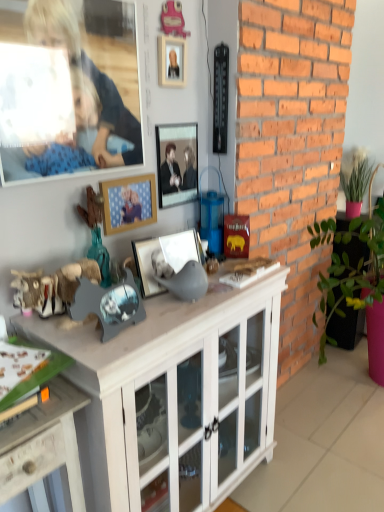
Where is `wooden photo frame at center, arranged as the 2th picture frame when ordered from the bottom`? This screenshot has height=512, width=384. wooden photo frame at center, arranged as the 2th picture frame when ordered from the bottom is located at coordinates (128, 203).

In order to click on wooden desk at lower left in this screenshot , I will do `click(43, 444)`.

This screenshot has height=512, width=384. What are the coordinates of `smooth wooden frame at upper left` in the screenshot? It's located at (86, 82).

The image size is (384, 512). What do you see at coordinates (177, 163) in the screenshot? I see `metallic silver picture frame at center, which is the third picture frame in bottom-to-top order` at bounding box center [177, 163].

What is the approximate width of white wood cabinet at center?

It is 16.77 inches.

Image resolution: width=384 pixels, height=512 pixels. What do you see at coordinates (174, 394) in the screenshot?
I see `white wood cabinet at center` at bounding box center [174, 394].

Locate an element on the screen. The height and width of the screenshot is (512, 384). matte silver picture frame at center, the 1th picture frame ordered from the bottom is located at coordinates (173, 265).

Describe the element at coordinates (173, 265) in the screenshot. I see `matte silver picture frame at center, the 3th picture frame positioned from the top` at that location.

You are a GUI agent. You are given a task and a screenshot of the screen. Output one action in this format:
    pyautogui.click(x=<x>, y=<y>)
    Task: Click on the wooden photo frame at center, which appears as the 2th picture frame when viewed from the top
    
    Given the screenshot: What is the action you would take?
    pyautogui.click(x=128, y=203)

Would you say white wood cabinet at center is outside metallic silver picture frame at center, placed as the first picture frame when sorted from top to bottom?

Yes, white wood cabinet at center is located beyond the bounds of metallic silver picture frame at center, placed as the first picture frame when sorted from top to bottom.

Can you confirm if white wood cabinet at center is smaller than metallic silver picture frame at center, placed as the first picture frame when sorted from top to bottom?

Actually, white wood cabinet at center might be larger than metallic silver picture frame at center, placed as the first picture frame when sorted from top to bottom.

In order to click on cabinetry that is on the left side of metallic silver picture frame at center, which is the third picture frame in bottom-to-top order in this screenshot , I will do `click(174, 394)`.

Are white wood cabinet at center and metallic silver picture frame at center, placed as the first picture frame when sorted from top to bottom, beside each other?

white wood cabinet at center and metallic silver picture frame at center, placed as the first picture frame when sorted from top to bottom, are not in contact.

Between wooden photo frame at center, arranged as the 2th picture frame when ordered from the bottom, and metallic silver picture frame at center, placed as the first picture frame when sorted from top to bottom, which one has larger width?

Wider between the two is metallic silver picture frame at center, placed as the first picture frame when sorted from top to bottom.

From a real-world perspective, is wooden photo frame at center, which appears as the 2th picture frame when viewed from the top, located beneath metallic silver picture frame at center, which is the third picture frame in bottom-to-top order?

Yes, from a real-world perspective, wooden photo frame at center, which appears as the 2th picture frame when viewed from the top, is below metallic silver picture frame at center, which is the third picture frame in bottom-to-top order.

Does wooden photo frame at center, which appears as the 2th picture frame when viewed from the top, have a greater height compared to metallic silver picture frame at center, which is the third picture frame in bottom-to-top order?

Incorrect, the height of wooden photo frame at center, which appears as the 2th picture frame when viewed from the top, is not larger of that of metallic silver picture frame at center, which is the third picture frame in bottom-to-top order.

How distant is wooden photo frame at center, arranged as the 2th picture frame when ordered from the bottom, from metallic silver picture frame at center, placed as the first picture frame when sorted from top to bottom?

The distance of wooden photo frame at center, arranged as the 2th picture frame when ordered from the bottom, from metallic silver picture frame at center, placed as the first picture frame when sorted from top to bottom, is 15.42 centimeters.

Is wooden desk at lower left touching matte silver picture frame at center, the 1th picture frame ordered from the bottom?

There is a gap between wooden desk at lower left and matte silver picture frame at center, the 1th picture frame ordered from the bottom.

Could matte silver picture frame at center, the 1th picture frame ordered from the bottom, be considered to be inside wooden desk at lower left?

No, wooden desk at lower left does not contain matte silver picture frame at center, the 1th picture frame ordered from the bottom.

Is wooden desk at lower left positioned with its back to matte silver picture frame at center, the 1th picture frame ordered from the bottom?

No, wooden desk at lower left's orientation is not away from matte silver picture frame at center, the 1th picture frame ordered from the bottom.

At what (x,y) coordinates should I click in order to perform the action: click on desk on the left of matte silver picture frame at center, the 3th picture frame positioned from the top. Please return your answer as a coordinate pair (x, y). Image resolution: width=384 pixels, height=512 pixels. Looking at the image, I should click on (43, 444).

Considering the relative sizes of wooden photo frame at center, which appears as the 2th picture frame when viewed from the top, and smooth wooden frame at upper left in the image provided, is wooden photo frame at center, which appears as the 2th picture frame when viewed from the top, bigger than smooth wooden frame at upper left?

No.

Based on the photo, which of these two, wooden photo frame at center, which appears as the 2th picture frame when viewed from the top, or smooth wooden frame at upper left, stands shorter?

wooden photo frame at center, which appears as the 2th picture frame when viewed from the top.

Can you tell me how much smooth wooden frame at upper left and wooden photo frame at center, which appears as the 2th picture frame when viewed from the top, differ in facing direction?

The facing directions of smooth wooden frame at upper left and wooden photo frame at center, which appears as the 2th picture frame when viewed from the top, are 0.884 degrees apart.

Is smooth wooden frame at upper left shorter than wooden photo frame at center, which appears as the 2th picture frame when viewed from the top?

In fact, smooth wooden frame at upper left may be taller than wooden photo frame at center, which appears as the 2th picture frame when viewed from the top.

Does smooth wooden frame at upper left have a larger size compared to wooden photo frame at center, which appears as the 2th picture frame when viewed from the top?

Yes.

Which is behind, point (68, 2) or point (118, 182)?

The point (118, 182) is farther from the camera.

Is wooden desk at lower left to the right of wooden photo frame at center, which appears as the 2th picture frame when viewed from the top, from the viewer's perspective?

No, wooden desk at lower left is not to the right of wooden photo frame at center, which appears as the 2th picture frame when viewed from the top.

How far apart are wooden desk at lower left and wooden photo frame at center, which appears as the 2th picture frame when viewed from the top?

A distance of 26.32 inches exists between wooden desk at lower left and wooden photo frame at center, which appears as the 2th picture frame when viewed from the top.

Is wooden photo frame at center, arranged as the 2th picture frame when ordered from the bottom, at the back of wooden desk at lower left?

wooden desk at lower left is not turned away from wooden photo frame at center, arranged as the 2th picture frame when ordered from the bottom.

From the picture: Is wooden desk at lower left wider than wooden photo frame at center, which appears as the 2th picture frame when viewed from the top?

Yes.

Is white wood cabinet at center positioned far away from matte silver picture frame at center, the 3th picture frame positioned from the top?

No, white wood cabinet at center is not far from matte silver picture frame at center, the 3th picture frame positioned from the top.

Is white wood cabinet at center completely or partially outside of matte silver picture frame at center, the 3th picture frame positioned from the top?

Yes.

Does point (172, 311) appear closer or farther from the camera than point (200, 284)?

Clearly, point (172, 311) is closer to the camera than point (200, 284).

Where is `cabinetry in front of the metallic silver picture frame at center, which is the third picture frame in bottom-to-top order`? cabinetry in front of the metallic silver picture frame at center, which is the third picture frame in bottom-to-top order is located at coordinates click(174, 394).

Where is `the 2nd picture frame counting from the left side of the metallic silver picture frame at center, which is the third picture frame in bottom-to-top order`? Image resolution: width=384 pixels, height=512 pixels. the 2nd picture frame counting from the left side of the metallic silver picture frame at center, which is the third picture frame in bottom-to-top order is located at coordinates (128, 203).

Based on their spatial positions, is wooden desk at lower left or smooth wooden frame at upper left further from wooden photo frame at center, arranged as the 2th picture frame when ordered from the bottom?

wooden desk at lower left lies further to wooden photo frame at center, arranged as the 2th picture frame when ordered from the bottom, than the other object.

Consider the image. Which object lies nearer to the anchor point wooden photo frame at center, arranged as the 2th picture frame when ordered from the bottom, metallic silver picture frame at center, which is the third picture frame in bottom-to-top order, or white wood cabinet at center?

The object closer to wooden photo frame at center, arranged as the 2th picture frame when ordered from the bottom, is metallic silver picture frame at center, which is the third picture frame in bottom-to-top order.

When comparing their distances from metallic silver picture frame at center, placed as the first picture frame when sorted from top to bottom, does wooden photo frame at center, arranged as the 2th picture frame when ordered from the bottom, or wooden desk at lower left seem further?

wooden desk at lower left is further to metallic silver picture frame at center, placed as the first picture frame when sorted from top to bottom.

Considering their positions, is wooden desk at lower left positioned closer to metallic silver picture frame at center, placed as the first picture frame when sorted from top to bottom, than wooden photo frame at center, which appears as the 2th picture frame when viewed from the top?

wooden photo frame at center, which appears as the 2th picture frame when viewed from the top, is closer to metallic silver picture frame at center, placed as the first picture frame when sorted from top to bottom.

Considering their positions, is smooth wooden frame at upper left positioned closer to white wood cabinet at center than matte silver picture frame at center, the 3th picture frame positioned from the top?

matte silver picture frame at center, the 3th picture frame positioned from the top, is closer to white wood cabinet at center.

From the image, which object appears to be nearer to white wood cabinet at center, wooden desk at lower left or smooth wooden frame at upper left?

Based on the image, wooden desk at lower left appears to be nearer to white wood cabinet at center.

Estimate the real-world distances between objects in this image. Which object is closer to wooden desk at lower left, wooden photo frame at center, arranged as the 2th picture frame when ordered from the bottom, or smooth wooden frame at upper left?

Among the two, wooden photo frame at center, arranged as the 2th picture frame when ordered from the bottom, is located nearer to wooden desk at lower left.

Considering their positions, is white wood cabinet at center positioned closer to wooden photo frame at center, which appears as the 2th picture frame when viewed from the top, than metallic silver picture frame at center, which is the third picture frame in bottom-to-top order?

metallic silver picture frame at center, which is the third picture frame in bottom-to-top order.

Find the location of a particular element. picture frame between wooden photo frame at center, which appears as the 2th picture frame when viewed from the top, and white wood cabinet at center in the up-down direction is located at coordinates (173, 265).

Locate an element on the screen. picture frame between metallic silver picture frame at center, which is the third picture frame in bottom-to-top order, and matte silver picture frame at center, the 3th picture frame positioned from the top, in the up-down direction is located at coordinates (128, 203).

In order to click on cabinetry between wooden photo frame at center, which appears as the 2th picture frame when viewed from the top, and wooden desk at lower left, in the vertical direction in this screenshot , I will do `click(174, 394)`.

Image resolution: width=384 pixels, height=512 pixels. Identify the location of picture frame between wooden photo frame at center, which appears as the 2th picture frame when viewed from the top, and wooden desk at lower left vertically. (173, 265).